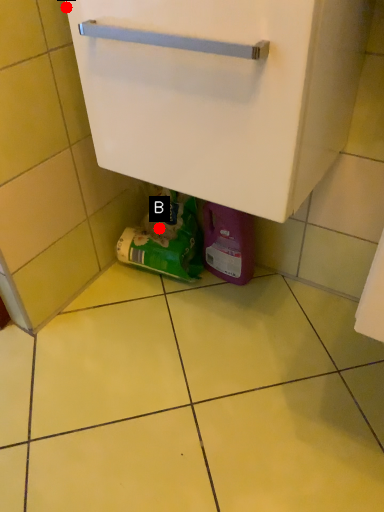
Question: Two points are circled on the image, labeled by A and B beside each circle. Among these points, which one is nearest to the camera?

Choices:
 (A) A is closer
 (B) B is closer

Answer: (A)